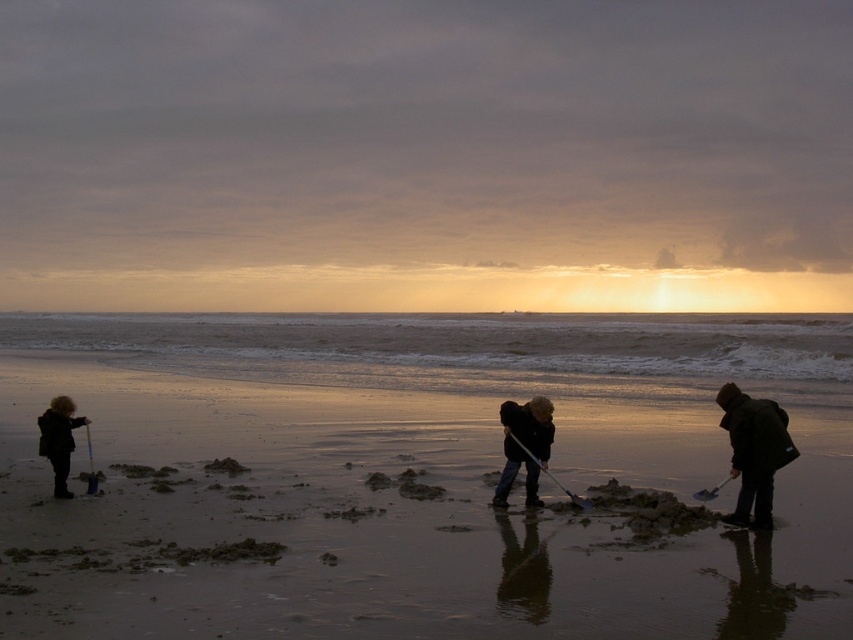
Question: Is dark brown wool coat at right smaller than metallic silver shovel at lower right?

Choices:
 (A) yes
 (B) no

Answer: (B)

Question: In this image, where is dark brown wool coat at right located relative to metallic silver shovel at lower right?

Choices:
 (A) left
 (B) right

Answer: (B)

Question: Which object is positioned farthest from the dark brown wool coat at right?

Choices:
 (A) dark blue jeans at center
 (B) sandy beach at center
 (C) metallic silver shovel at lower right

Answer: (B)

Question: Considering the relative positions of dark blue jeans at center and metallic silver shovel at lower right in the image provided, where is dark blue jeans at center located with respect to metallic silver shovel at lower right?

Choices:
 (A) right
 (B) left

Answer: (B)

Question: Which object is closer to the camera taking this photo?

Choices:
 (A) dark brown wool coat at left
 (B) metallic silver shovel at lower right
 (C) sandy beach at center

Answer: (C)

Question: Which point is closer to the camera taking this photo?

Choices:
 (A) (51, 467)
 (B) (746, 486)

Answer: (B)